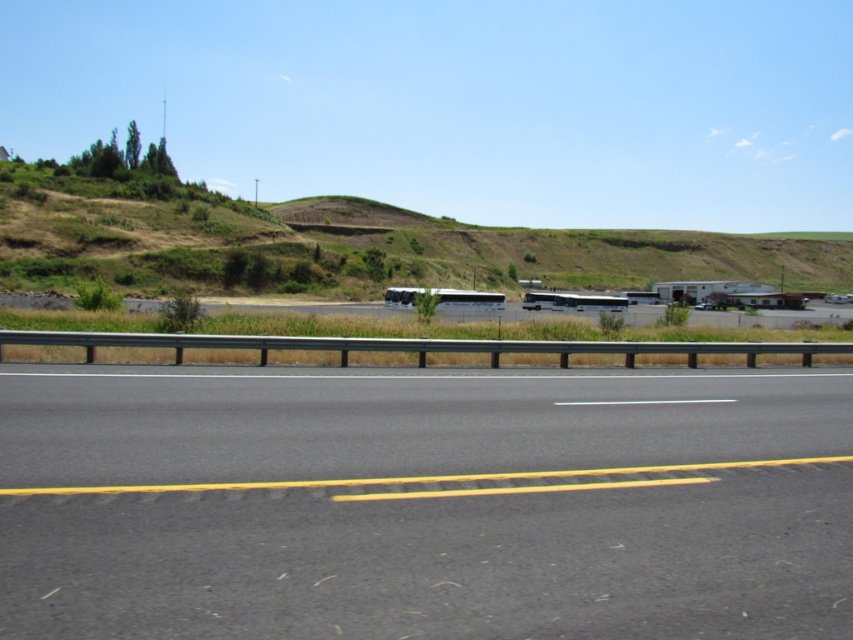
Does black asphalt road at center come behind green grassy hillside at upper center?

No, black asphalt road at center is closer to the viewer.

Can you confirm if black asphalt road at center is shorter than green grassy hillside at upper center?

Indeed, black asphalt road at center has a lesser height compared to green grassy hillside at upper center.

Find the location of a particular element. black asphalt road at center is located at coordinates (425, 502).

Is black asphalt road at center above metallic silver recreational vehicle at center?

Incorrect, black asphalt road at center is not positioned above metallic silver recreational vehicle at center.

Describe the element at coordinates (425, 502) in the screenshot. I see `black asphalt road at center` at that location.

The width and height of the screenshot is (853, 640). What do you see at coordinates (425, 502) in the screenshot? I see `black asphalt road at center` at bounding box center [425, 502].

This screenshot has width=853, height=640. I want to click on black asphalt road at center, so 425,502.

Does black asphalt road at center have a greater width compared to metallic silver bus at center?

No, black asphalt road at center is not wider than metallic silver bus at center.

Is point (584, 470) in front of point (529, 300)?

Yes.

Which is behind, point (329, 392) or point (621, 301)?

Point (621, 301)

Where is `black asphalt road at center`? This screenshot has width=853, height=640. black asphalt road at center is located at coordinates (425, 502).